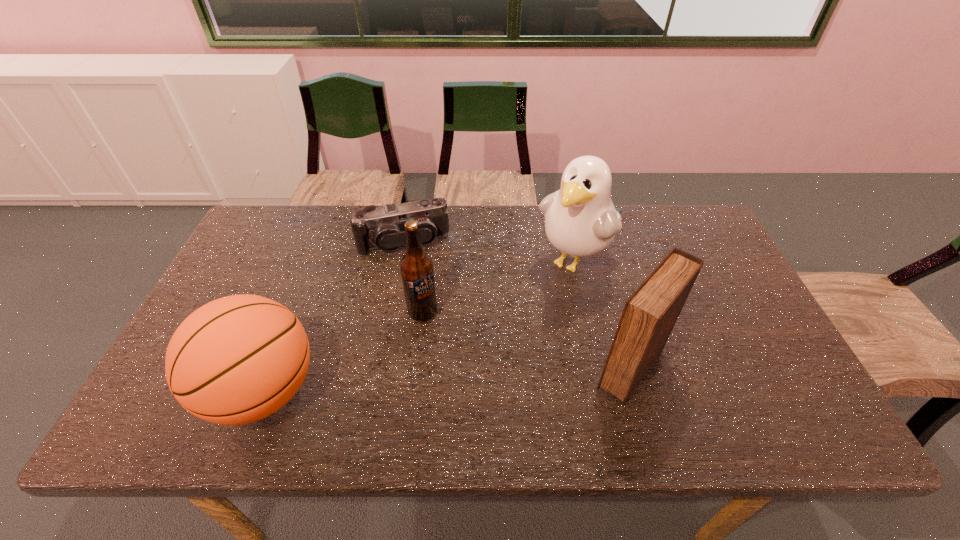
This screenshot has width=960, height=540. In order to click on object positioned at the left edge in this screenshot , I will do `click(238, 359)`.

The image size is (960, 540). Identify the location of object positioned at the near left corner. (238, 359).

Where is `free space at the far edge of the desktop`? free space at the far edge of the desktop is located at coordinates (313, 222).

The height and width of the screenshot is (540, 960). Find the location of `free space at the near edge of the desktop`. free space at the near edge of the desktop is located at coordinates (468, 371).

Locate an element on the screen. free region at the left edge is located at coordinates coord(247,293).

The height and width of the screenshot is (540, 960). I want to click on vacant space at the right edge of the desktop, so click(x=699, y=255).

This screenshot has width=960, height=540. In the image, there is a desktop. Identify the location of vacant space at the far left corner. (268, 217).

Where is `vacant space at the near left corner of the desktop`? The height and width of the screenshot is (540, 960). vacant space at the near left corner of the desktop is located at coordinates click(165, 387).

Locate an element on the screen. This screenshot has width=960, height=540. vacant space at the far right corner of the desktop is located at coordinates (697, 224).

The height and width of the screenshot is (540, 960). I want to click on free spot between the camcorder and the basketball, so click(333, 317).